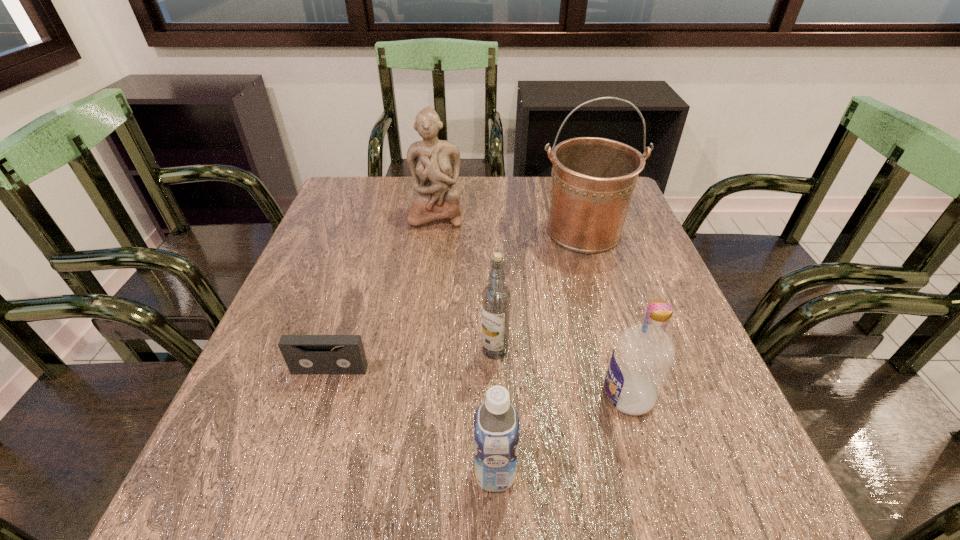
Locate an element on the screen. empty space that is in between the bucket and the third farthest object is located at coordinates (540, 291).

Where is `blank region between the right vodka and the bucket`? blank region between the right vodka and the bucket is located at coordinates (606, 314).

Where is `empty location between the videotape and the figurine`? This screenshot has width=960, height=540. empty location between the videotape and the figurine is located at coordinates (383, 292).

Identify which object is the closest to the left vodka. Please provide its 2D coordinates. Your answer should be formatted as a tuple, i.e. [(x, y)], where the tuple contains the x and y coordinates of a point satisfying the conditions above.

[(642, 358)]

Find the location of a particular element. the second closest object to the bucket is located at coordinates (496, 297).

Locate an element on the screen. This screenshot has height=540, width=960. blank space that satisfies the following two spatial constraints: 1. on the front-facing side of the bucket; 2. on the right side of the fifth shortest object is located at coordinates (434, 232).